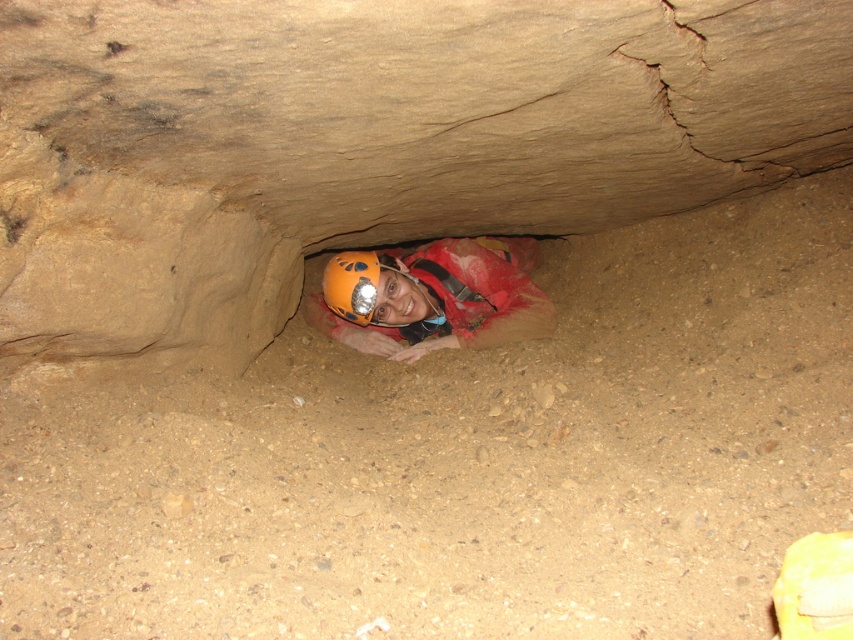
Is point (525, 285) more distant than point (366, 273)?

Yes, point (525, 285) is farther from viewer.

Is orange helmet at center above orange matte helmet at center?

Incorrect, orange helmet at center is not positioned above orange matte helmet at center.

Is point (438, 316) more distant than point (369, 305)?

Yes, it is behind point (369, 305).

Locate an element on the screen. This screenshot has height=640, width=853. orange helmet at center is located at coordinates (433, 296).